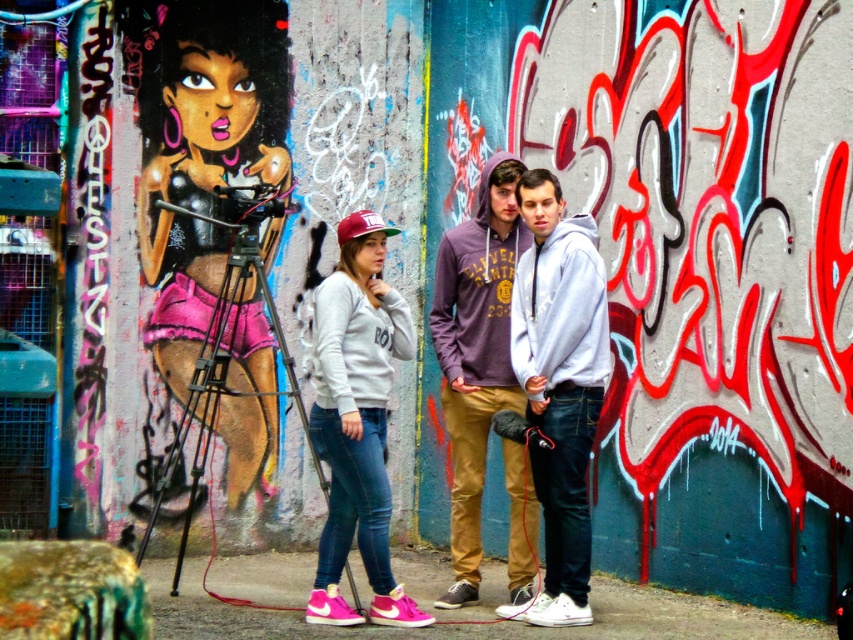
Question: In this image, where is shiny pink shorts at left located relative to light gray hoodie at center?

Choices:
 (A) right
 (B) left

Answer: (B)

Question: Which of the following is the closest to the observer?

Choices:
 (A) matte gray hoodie at center
 (B) light gray hoodie at center

Answer: (A)

Question: In this image, where is shiny pink shorts at left located relative to matte purple hoodie at center?

Choices:
 (A) below
 (B) above

Answer: (B)

Question: Which of the following is the farthest from the observer?

Choices:
 (A) (x=323, y=429)
 (B) (x=524, y=364)

Answer: (B)

Question: Is light gray hoodie at center thinner than matte purple hoodie at center?

Choices:
 (A) no
 (B) yes

Answer: (B)

Question: Estimate the real-world distances between objects in this image. Which object is farther from the matte gray hoodie at center?

Choices:
 (A) shiny pink shorts at left
 (B) white fleece hoodie at center
 (C) light gray hoodie at center

Answer: (A)